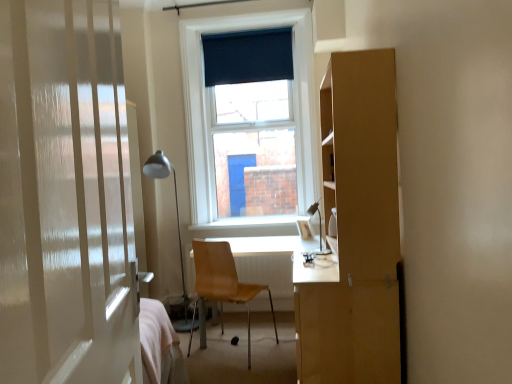
Question: Can you confirm if metallic silver table lamp at left, acting as the 1th table lamp starting from the back, is thinner than dark blue fabric at upper center?

Choices:
 (A) no
 (B) yes

Answer: (A)

Question: Is metallic silver table lamp at left, placed as the second table lamp when sorted from right to left, taller than dark blue fabric at upper center?

Choices:
 (A) no
 (B) yes

Answer: (B)

Question: Does metallic silver table lamp at left, placed as the second table lamp when sorted from right to left, appear on the right side of dark blue fabric at upper center?

Choices:
 (A) yes
 (B) no

Answer: (B)

Question: From the image's perspective, is metallic silver table lamp at left, the 1th table lamp in the left-to-right sequence, below dark blue fabric at upper center?

Choices:
 (A) no
 (B) yes

Answer: (B)

Question: Is metallic silver table lamp at left, acting as the 1th table lamp starting from the back, outside of dark blue fabric at upper center?

Choices:
 (A) yes
 (B) no

Answer: (A)

Question: Can you confirm if metallic silver table lamp at left, acting as the 1th table lamp starting from the back, is wider than dark blue fabric at upper center?

Choices:
 (A) no
 (B) yes

Answer: (B)

Question: Is white glossy door at left positioned behind light brown wooden desk at center?

Choices:
 (A) yes
 (B) no

Answer: (B)

Question: Does white glossy door at left turn towards light brown wooden desk at center?

Choices:
 (A) no
 (B) yes

Answer: (A)

Question: Is white glossy door at left not inside light brown wooden desk at center?

Choices:
 (A) yes
 (B) no

Answer: (A)

Question: Is white glossy door at left to the right of light brown wooden desk at center from the viewer's perspective?

Choices:
 (A) no
 (B) yes

Answer: (A)

Question: Are white glossy door at left and light brown wooden desk at center far apart?

Choices:
 (A) yes
 (B) no

Answer: (A)

Question: Considering the relative sizes of white glossy door at left and light brown wooden desk at center in the image provided, is white glossy door at left smaller than light brown wooden desk at center?

Choices:
 (A) yes
 (B) no

Answer: (A)

Question: Considering the relative sizes of dark blue fabric at upper center and wooden chair at center in the image provided, is dark blue fabric at upper center thinner than wooden chair at center?

Choices:
 (A) no
 (B) yes

Answer: (B)